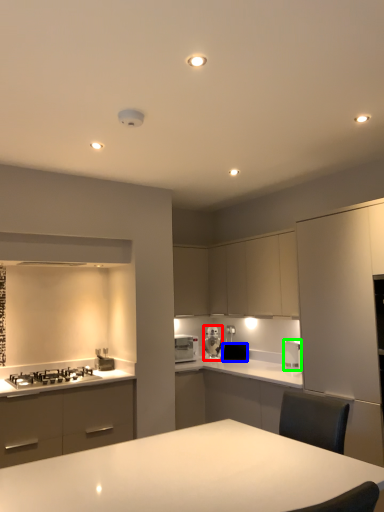
Question: Which object is positioned farthest from kitchen appliance (highlighted by a red box)? Select from appliance (highlighted by a blue box) and kitchen appliance (highlighted by a green box).

Choices:
 (A) appliance
 (B) kitchen appliance

Answer: (B)